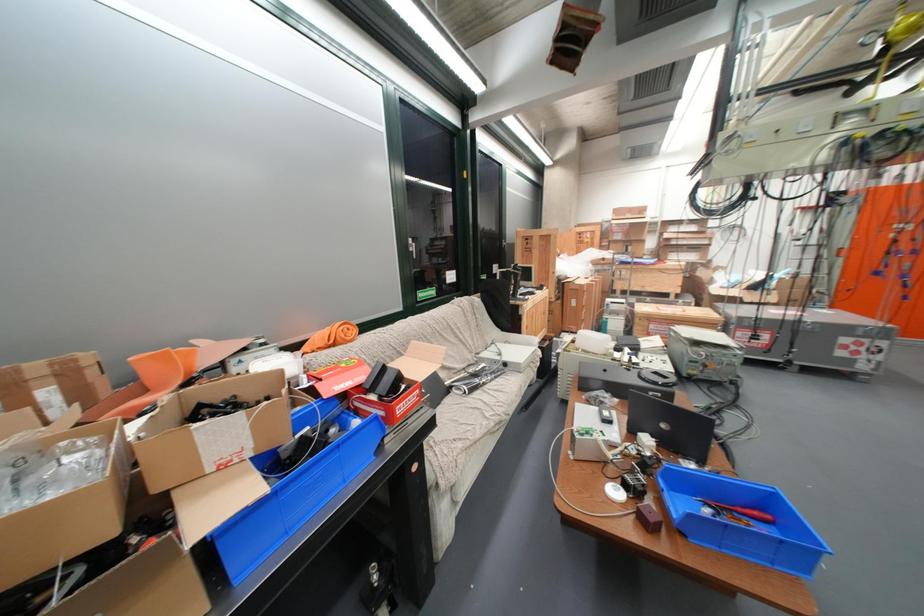
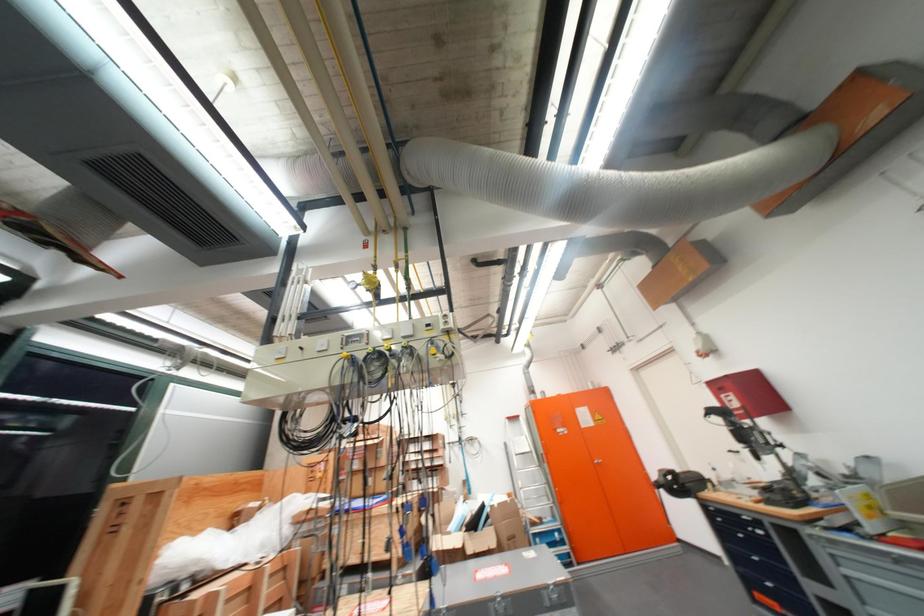
Where in the second image is the point corresponding to the point at 710,305 from the first image?

(438, 573)